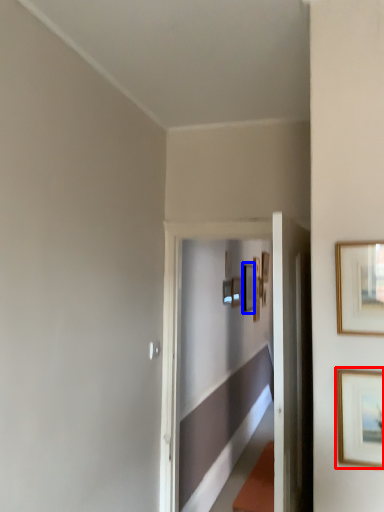
Question: Among these objects, which one is nearest to the camera, picture frame (highlighted by a red box) or picture frame (highlighted by a blue box)?

Choices:
 (A) picture frame
 (B) picture frame

Answer: (A)